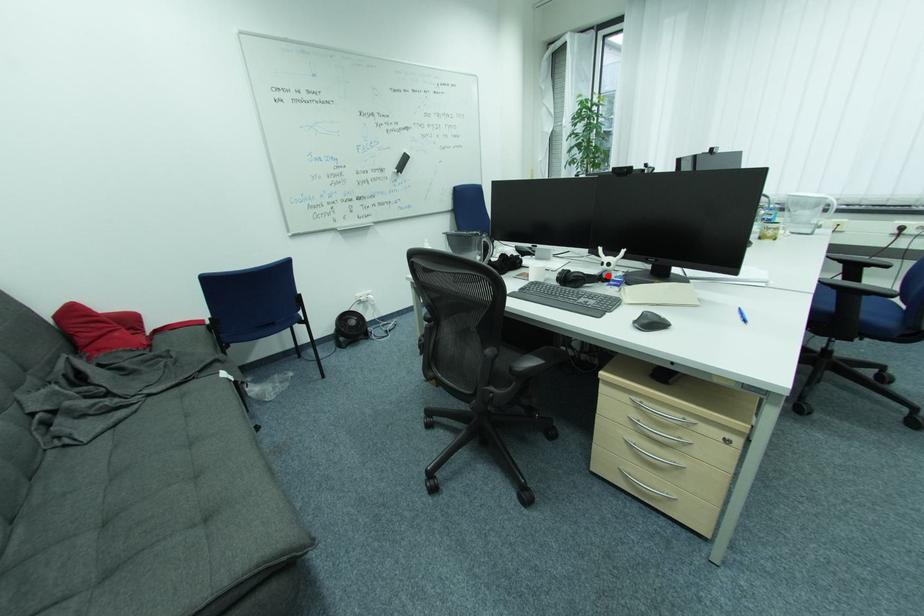
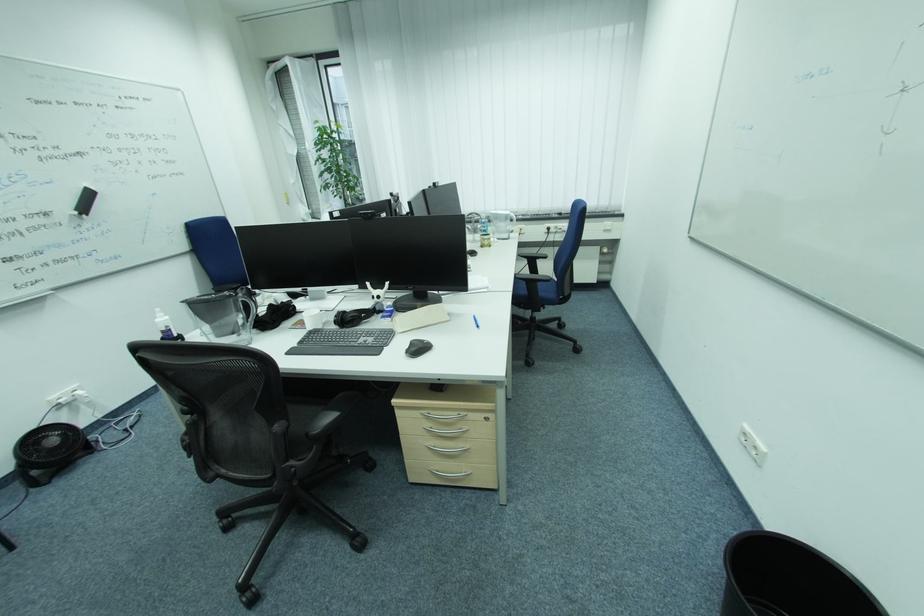
Where in the second image is the point corresponding to the highlighted location from the first image?

(381, 309)